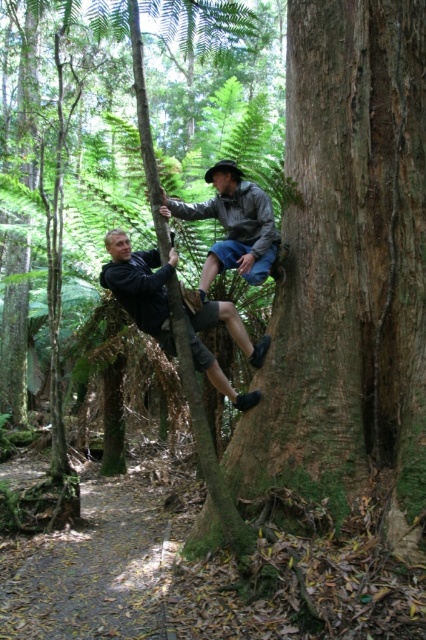
You are a hiker navigating through the forest and need to reach the top of the tree trunk. There are two points marked on the trunk at coordinates point (x=311, y=326) and point (x=236, y=257). Which point should you aim for first if you want to climb upwards?

You should aim for point (x=236, y=257) first because point (x=311, y=326) is in front of it, meaning point (x=236, y=257) is lower and closer to the base of the tree trunk.

You are standing at the base of the green mossy tree trunk at center and want to climb to the top. If your climbing gear can reach up to 10 feet, will you be able to reach the top?

The green mossy tree trunk at center is 12.94 feet from viewer. Since your gear can only reach up to 10 feet, you will not be able to reach the top.